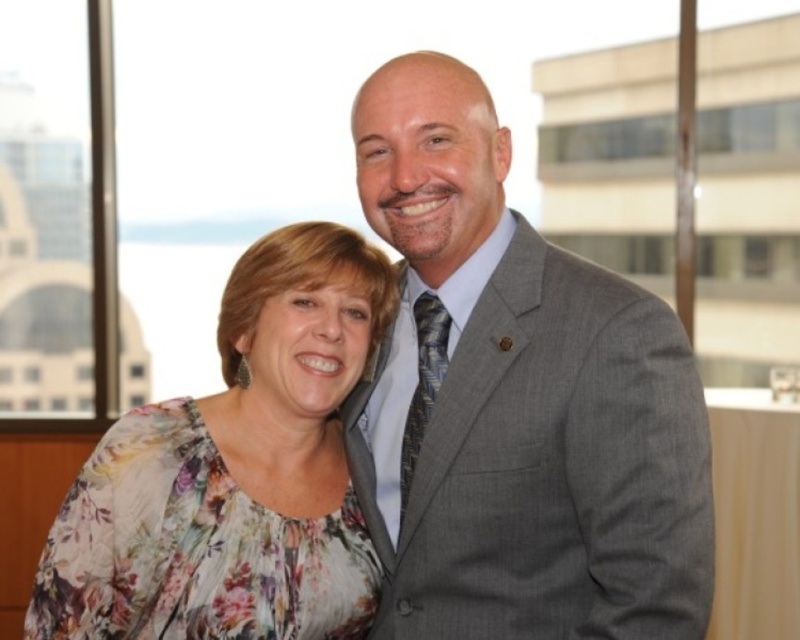
Question: Can you confirm if gray textured suit at center is bigger than floral fabric blouse at center?

Choices:
 (A) yes
 (B) no

Answer: (A)

Question: Which point is closer to the camera taking this photo?

Choices:
 (A) (173, 572)
 (B) (541, 349)

Answer: (B)

Question: Does gray textured suit at center have a lesser width compared to floral fabric blouse at center?

Choices:
 (A) yes
 (B) no

Answer: (A)

Question: Which point is closer to the camera?

Choices:
 (A) (544, 506)
 (B) (296, 253)

Answer: (A)

Question: Does gray textured suit at center come in front of floral fabric blouse at center?

Choices:
 (A) yes
 (B) no

Answer: (A)

Question: Among these objects, which one is farthest from the camera?

Choices:
 (A) gray textured suit at center
 (B) floral fabric blouse at center

Answer: (B)